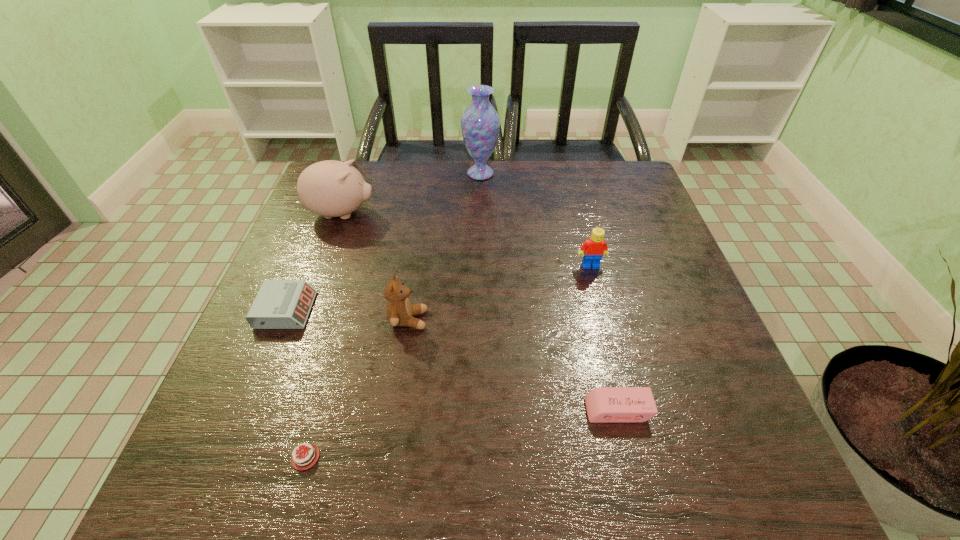
This screenshot has width=960, height=540. In order to click on piggy bank that is at the left edge in this screenshot , I will do `click(330, 188)`.

This screenshot has height=540, width=960. I want to click on alarm clock that is at the left edge, so click(x=280, y=304).

Locate an element on the screen. This screenshot has width=960, height=540. chocolate cake that is at the left edge is located at coordinates (309, 453).

Where is `object that is positioned at the far left corner`? The width and height of the screenshot is (960, 540). object that is positioned at the far left corner is located at coordinates (330, 188).

This screenshot has height=540, width=960. I want to click on object positioned at the near left corner, so click(309, 453).

This screenshot has height=540, width=960. In the image, there is a desktop. Find the location of `vacant space at the far edge`. vacant space at the far edge is located at coordinates (429, 166).

Where is `vacant space at the left edge`? Image resolution: width=960 pixels, height=540 pixels. vacant space at the left edge is located at coordinates (278, 341).

Find the location of a particular element. vacant space at the right edge of the desktop is located at coordinates (650, 380).

At what (x,y) coordinates should I click in order to perform the action: click on free point at the far left corner. Please return your answer as a coordinate pair (x, y). The width and height of the screenshot is (960, 540). Looking at the image, I should click on (369, 173).

Where is `free point at the far right corner`? free point at the far right corner is located at coordinates (618, 172).